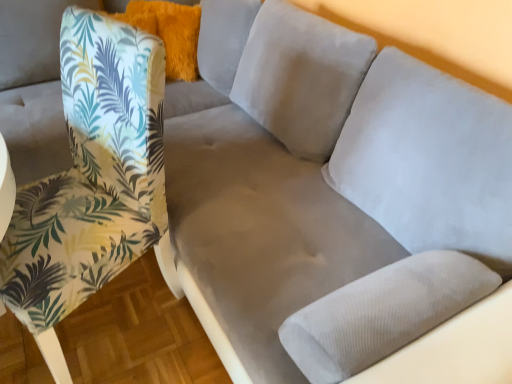
Question: Is the depth of fluffy orange pillow at upper left less than that of printed fabric chair at left?

Choices:
 (A) yes
 (B) no

Answer: (B)

Question: From the image's perspective, is fluffy orange pillow at upper left above printed fabric chair at left?

Choices:
 (A) yes
 (B) no

Answer: (A)

Question: Does fluffy orange pillow at upper left have a greater height compared to printed fabric chair at left?

Choices:
 (A) yes
 (B) no

Answer: (B)

Question: Is fluffy orange pillow at upper left thinner than printed fabric chair at left?

Choices:
 (A) yes
 (B) no

Answer: (A)

Question: Is fluffy orange pillow at upper left not inside printed fabric chair at left?

Choices:
 (A) no
 (B) yes

Answer: (B)

Question: Does fluffy orange pillow at upper left have a greater width compared to printed fabric chair at left?

Choices:
 (A) no
 (B) yes

Answer: (A)

Question: Is printed fabric chair at left positioned in front of fluffy orange pillow at upper left?

Choices:
 (A) yes
 (B) no

Answer: (A)

Question: Can you confirm if printed fabric chair at left is shorter than fluffy orange pillow at upper left?

Choices:
 (A) no
 (B) yes

Answer: (A)

Question: Is fluffy orange pillow at upper left located within printed fabric chair at left?

Choices:
 (A) no
 (B) yes

Answer: (A)

Question: Is printed fabric chair at left further to camera compared to fluffy orange pillow at upper left?

Choices:
 (A) no
 (B) yes

Answer: (A)

Question: Is printed fabric chair at left next to fluffy orange pillow at upper left and touching it?

Choices:
 (A) yes
 (B) no

Answer: (B)

Question: Can you confirm if printed fabric chair at left is positioned to the left of fluffy orange pillow at upper left?

Choices:
 (A) no
 (B) yes

Answer: (B)

Question: Is point (159, 233) closer or farther from the camera than point (183, 52)?

Choices:
 (A) farther
 (B) closer

Answer: (B)